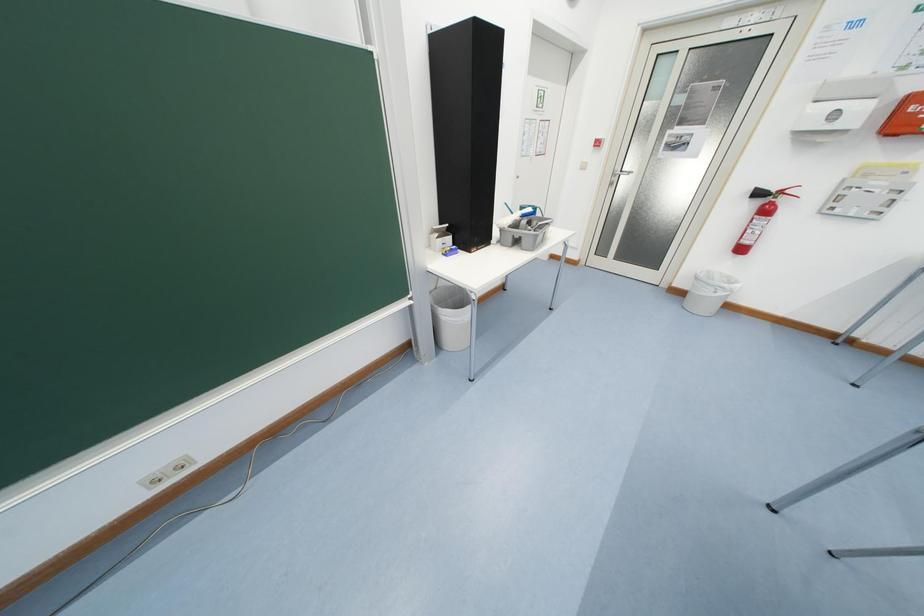
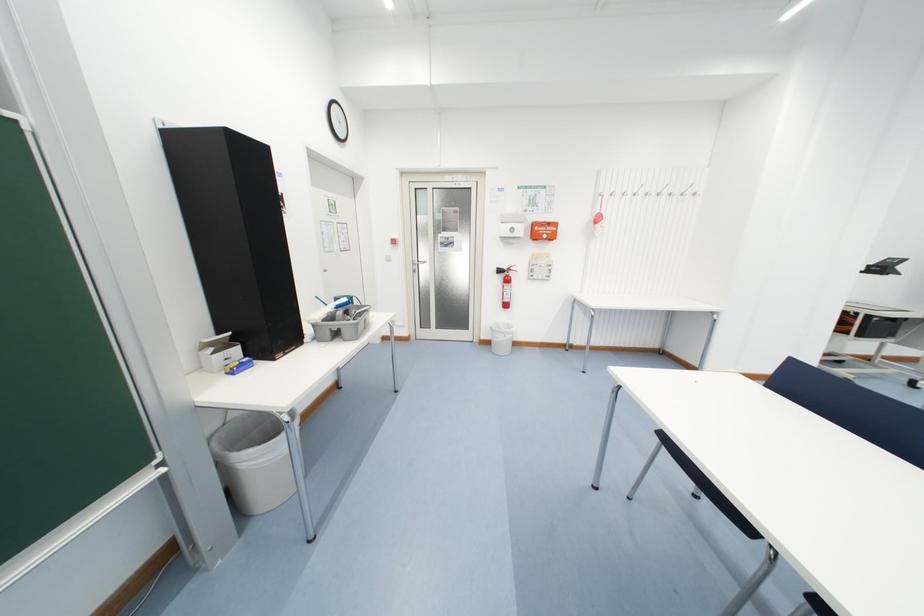
Question: The camera is either moving clockwise (left) or counter-clockwise (right) around the object. The first image is from the beginning of the video and the second image is from the end. Is the camera moving left or right when shooting the video?

Choices:
 (A) Left
 (B) Right

Answer: (A)